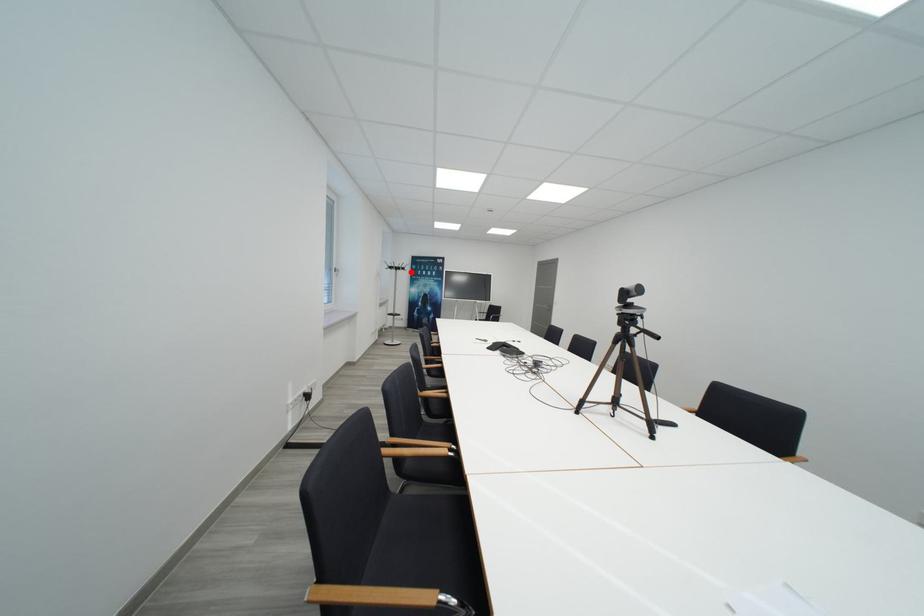
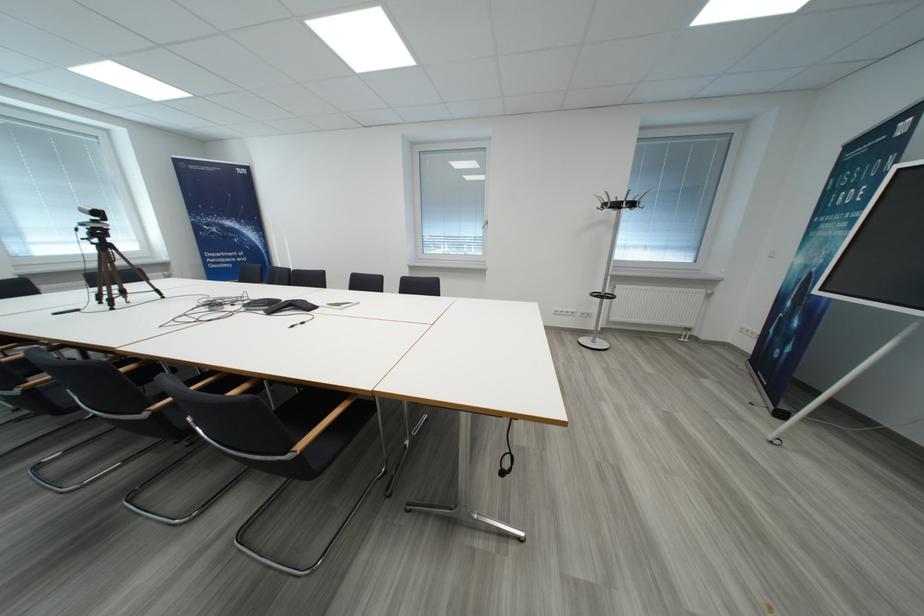
Question: I am providing you with two images of the same scene from different viewpoints. In image1, a red point is highlighted. Considering the same 3D point in image2, which of the following is correct?

Choices:
 (A) It is closer
 (B) It is farther

Answer: (B)